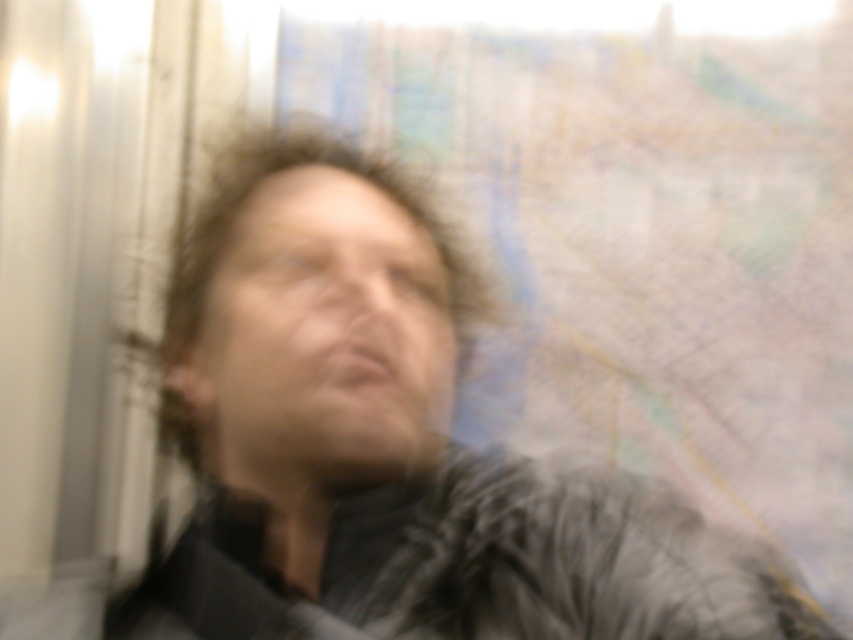
You are a photographer trying to adjust the lighting for a photo shoot. The subject is wearing a dark gray fur coat at center. The light source is coming from the left side. Where should you place the reflector to best illuminate the subject?

Since the light source is coming from the left side, placing the reflector on the right side of the subject will help bounce light back onto the dark gray fur coat at center, reducing shadows and evenly lighting the subject.

You are standing in front of the image and want to touch the two points mentioned. Which point, point (598, 612) or point (193, 403), is closer to you?

Point (598, 612) is closer to the viewer than point (193, 403).